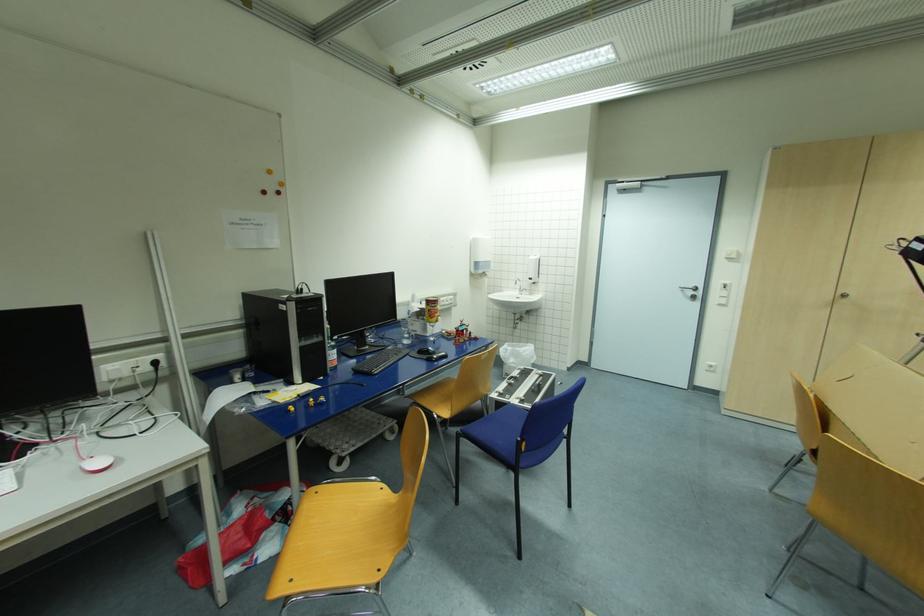
At what (x,y) coordinates should I click in order to perform the action: click on metal cabinet knob. Please return your answer as a coordinate pair (x, y). Looking at the image, I should click on (843, 294).